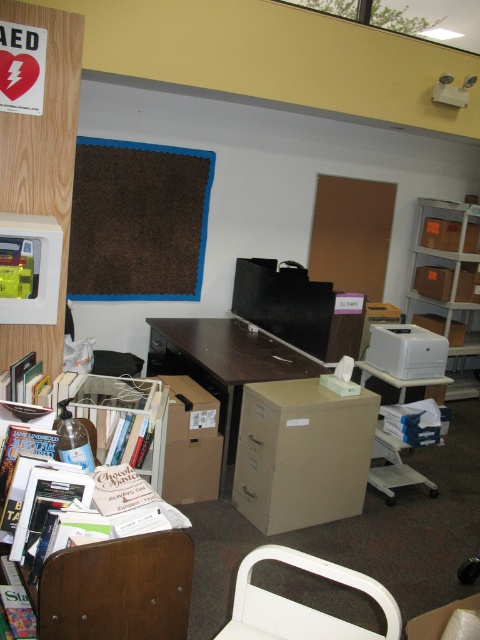
Which is below, brown cardboard file cabinet at center or metallic silver bookshelf at lower left?

Positioned lower is metallic silver bookshelf at lower left.

Is brown cardboard file cabinet at center above metallic silver bookshelf at lower left?

Yes, brown cardboard file cabinet at center is above metallic silver bookshelf at lower left.

The image size is (480, 640). I want to click on brown cardboard file cabinet at center, so click(223, 365).

Between brown cardboard file cabinet at center and white plastic chair at lower center, which one has more height?

Standing taller between the two is brown cardboard file cabinet at center.

Based on the photo, does brown cardboard file cabinet at center have a larger size compared to white plastic chair at lower center?

Yes, brown cardboard file cabinet at center is bigger than white plastic chair at lower center.

At what (x,y) coordinates should I click in order to perform the action: click on brown cardboard file cabinet at center. Please return your answer as a coordinate pair (x, y). This screenshot has width=480, height=640. Looking at the image, I should click on (223, 365).

Locate an element on the screen. This screenshot has height=640, width=480. brown felt bulletin board at upper left is located at coordinates (137, 220).

Who is lower down, brown felt bulletin board at upper left or beige cardboard file cabinet at center?

Positioned lower is beige cardboard file cabinet at center.

Is point (135, 198) positioned in front of point (273, 410)?

No, (135, 198) is behind (273, 410).

In order to click on brown felt bulletin board at upper left in this screenshot , I will do `click(137, 220)`.